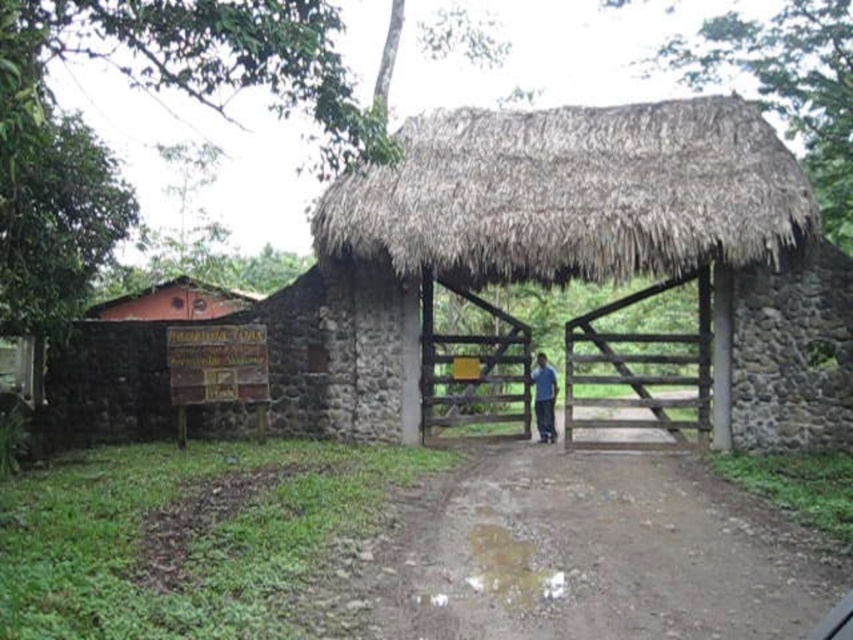
Is thatched straw hut at center further to the viewer compared to blue fabric shirt at center?

No, thatched straw hut at center is closer to the viewer.

Is thatched straw hut at center closer to camera compared to blue fabric shirt at center?

Yes, thatched straw hut at center is in front of blue fabric shirt at center.

Does point (399, 220) come closer to viewer compared to point (544, 381)?

Yes.

Locate an element on the screen. The width and height of the screenshot is (853, 640). thatched straw hut at center is located at coordinates (573, 193).

Does brown dirt track at center have a smaller size compared to brown thatch hut at upper left?

Yes, brown dirt track at center is smaller than brown thatch hut at upper left.

Is the position of brown dirt track at center less distant than that of brown thatch hut at upper left?

That is True.

Identify the location of brown dirt track at center. The image size is (853, 640). (592, 554).

Is brown dirt track at center wider than thatched straw hut at center?

Indeed, brown dirt track at center has a greater width compared to thatched straw hut at center.

Does brown dirt track at center lie in front of thatched straw hut at center?

Yes, brown dirt track at center is in front of thatched straw hut at center.

Does point (659, 538) come closer to viewer compared to point (746, 240)?

Yes, it is in front of point (746, 240).

In order to click on brown dirt track at center in this screenshot , I will do `click(592, 554)`.